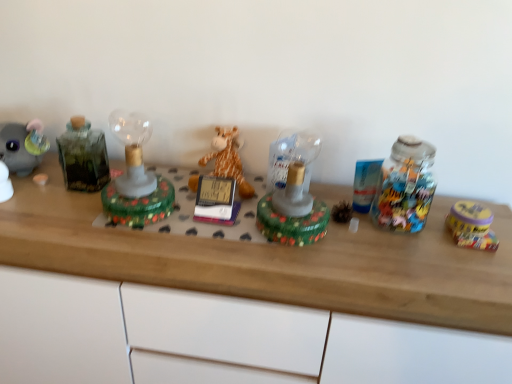
I want to click on free space in front of yellow matte tin at right, the first toy when ordered from right to left, so click(x=470, y=265).